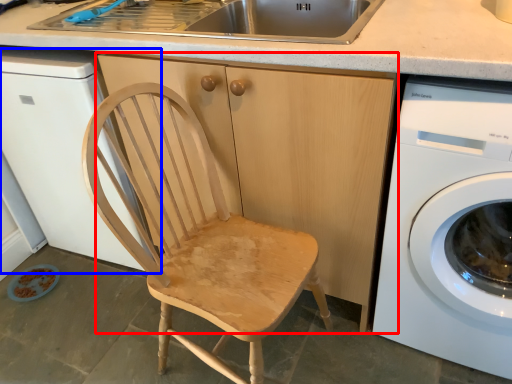
Question: Which object is closer to the camera taking this photo, cabinetry (highlighted by a red box) or dish washer (highlighted by a blue box)?

Choices:
 (A) cabinetry
 (B) dish washer

Answer: (A)